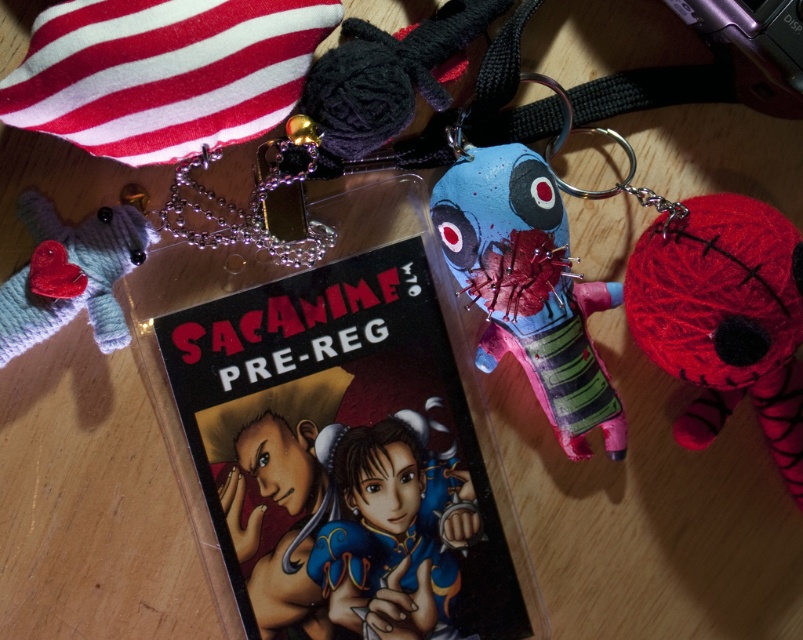
Which of these two, yarn-like red plush toy at right or knitted wool heart at left, stands shorter?

Standing shorter between the two is knitted wool heart at left.

This screenshot has width=803, height=640. Describe the element at coordinates (724, 317) in the screenshot. I see `yarn-like red plush toy at right` at that location.

You are a GUI agent. You are given a task and a screenshot of the screen. Output one action in this format:
    pyautogui.click(x=<x>, y=<y>)
    Task: Click on the yarn-like red plush toy at right
    
    Given the screenshot: What is the action you would take?
    pyautogui.click(x=724, y=317)

Is point (793, 401) less distant than point (341, 448)?

Yes.

This screenshot has height=640, width=803. In order to click on yarn-like red plush toy at right in this screenshot , I will do `click(724, 317)`.

Who is shorter, matte blue plush toy at center or matte blue fabric doll at center?

matte blue fabric doll at center is shorter.

Who is positioned more to the left, matte blue plush toy at center or matte blue fabric doll at center?

matte blue fabric doll at center

Between point (471, 260) and point (357, 576), which one is positioned in front?

Positioned in front is point (471, 260).

Find the location of a particular element. matte blue plush toy at center is located at coordinates (528, 285).